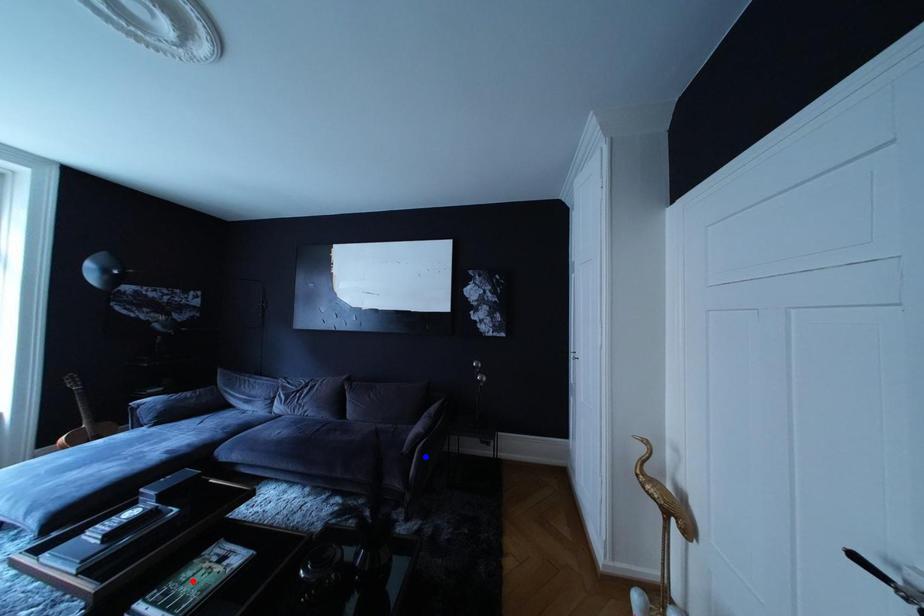
Question: Which of the two points in the image is closer to the camera?

Choices:
 (A) Blue point is closer.
 (B) Red point is closer.

Answer: (B)